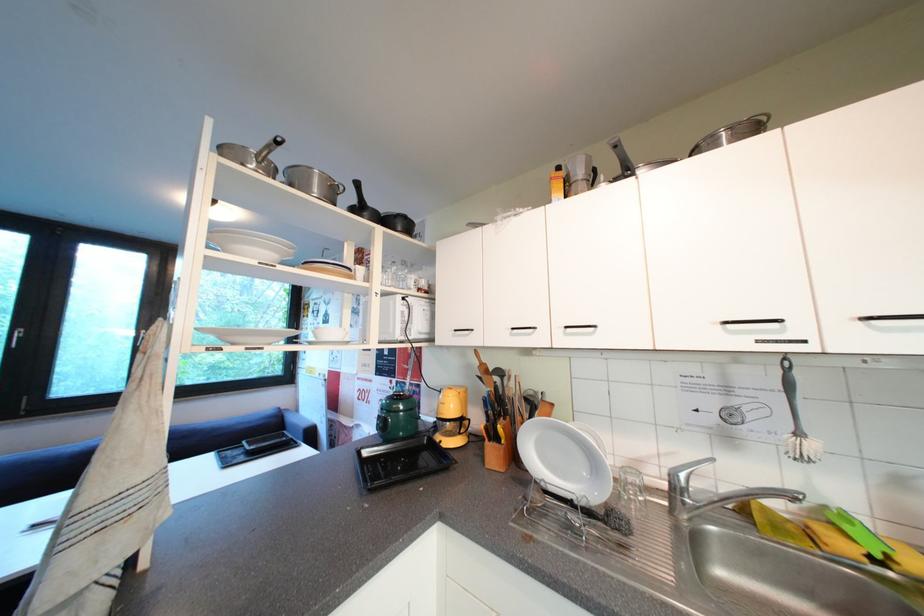
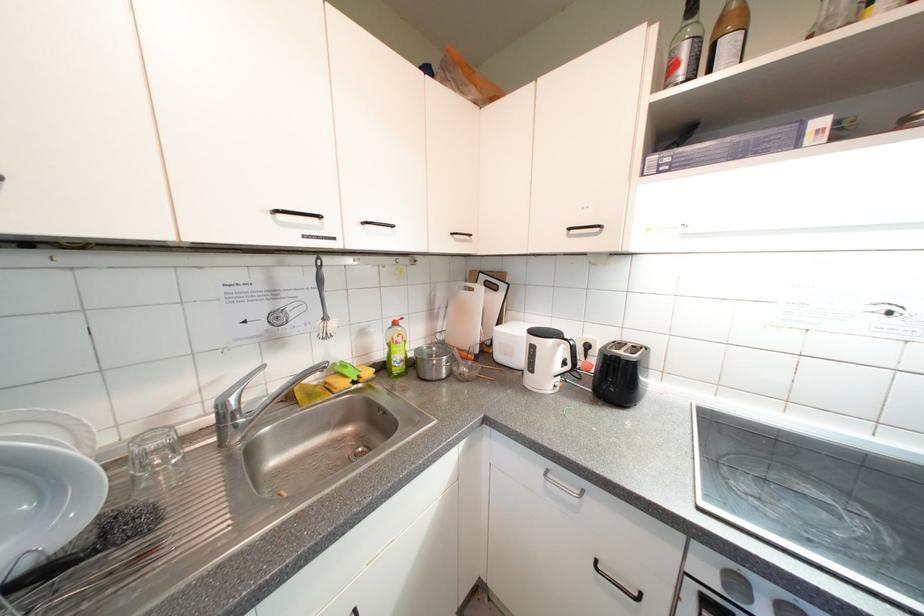
Where in the second image is the point corresponding to point 807,436 from the first image?

(333, 321)